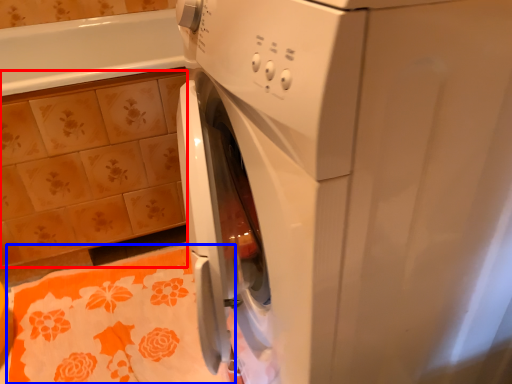
Question: Which object is further to the camera taking this photo, ceramic tile (highlighted by a red box) or bath towel (highlighted by a blue box)?

Choices:
 (A) ceramic tile
 (B) bath towel

Answer: (A)